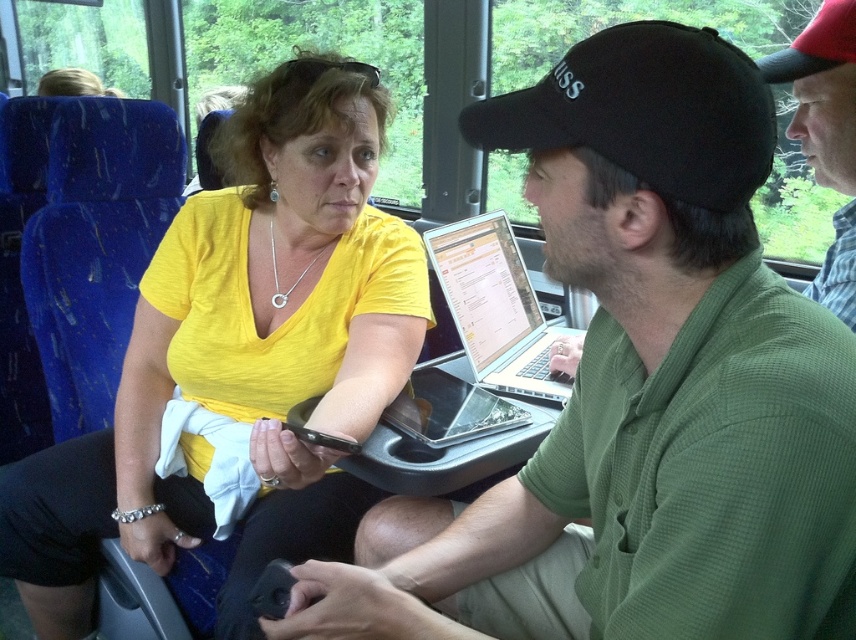
Question: Which point is farther to the camera?

Choices:
 (A) black mesh baseball cap at upper center
 (B) glossy silver laptop at center
 (C) green plaid shirt at upper right

Answer: (B)

Question: Considering the real-world distances, which object is closest to the yellow matte shirt at upper center?

Choices:
 (A) green textured shirt at center
 (B) glossy silver laptop at center
 (C) silver metallic laptop at center
 (D) green plaid shirt at upper right

Answer: (B)

Question: Is yellow matte shirt at upper center wider than green plaid shirt at upper right?

Choices:
 (A) yes
 (B) no

Answer: (A)

Question: Can you confirm if yellow matte shirt at upper center is positioned above green plaid shirt at upper right?

Choices:
 (A) no
 (B) yes

Answer: (A)

Question: Considering the relative positions of green textured shirt at center and black mesh baseball cap at upper center in the image provided, where is green textured shirt at center located with respect to black mesh baseball cap at upper center?

Choices:
 (A) above
 (B) below

Answer: (B)

Question: Among these points, which one is farthest from the camera?

Choices:
 (A) (831, 156)
 (B) (658, 429)
 (C) (408, 426)

Answer: (C)